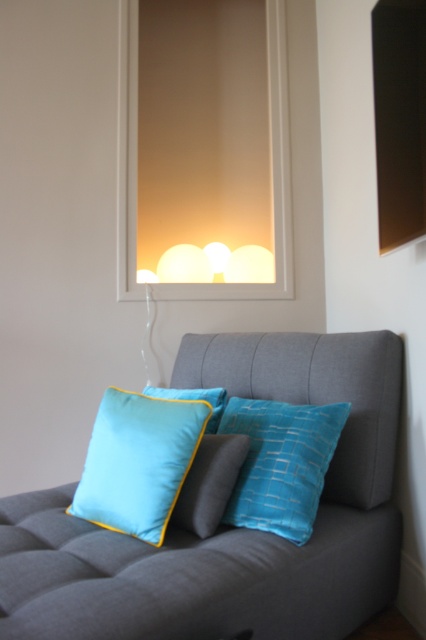
Who is positioned more to the right, tufted fabric couch at center or twill blue pillow at center?

tufted fabric couch at center is more to the right.

Is tufted fabric couch at center behind twill blue pillow at center?

No, tufted fabric couch at center is closer to the viewer.

Describe the element at coordinates (229, 528) in the screenshot. The width and height of the screenshot is (426, 640). I see `tufted fabric couch at center` at that location.

Where is `tufted fabric couch at center`? The image size is (426, 640). tufted fabric couch at center is located at coordinates (229, 528).

Who is positioned more to the right, tufted fabric couch at center or turquoise satin pillow at center?

From the viewer's perspective, turquoise satin pillow at center appears more on the right side.

What are the coordinates of `tufted fabric couch at center` in the screenshot? It's located at (229, 528).

Is teal fabric cushion at center to the right of turquoise satin pillow at center from the viewer's perspective?

In fact, teal fabric cushion at center is to the left of turquoise satin pillow at center.

Which is more to the right, teal fabric cushion at center or turquoise satin pillow at center?

From the viewer's perspective, turquoise satin pillow at center appears more on the right side.

Which is in front, point (167, 472) or point (250, 426)?

Point (167, 472)

This screenshot has height=640, width=426. Identify the location of teal fabric cushion at center. 138,461.